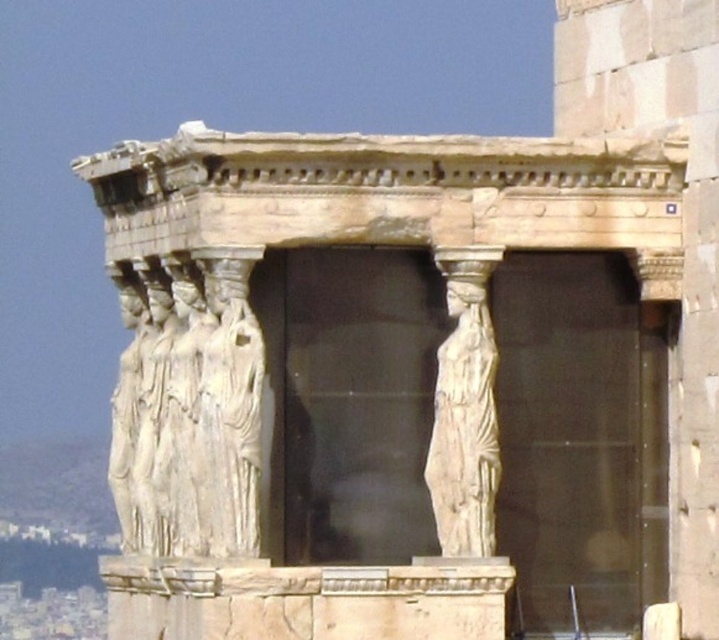
Does white marble statues at center have a lesser height compared to white marble statue at center?

No, white marble statues at center is not shorter than white marble statue at center.

Which is more to the right, white marble statues at center or white marble statue at center?

white marble statue at center

Is point (147, 486) positioned after point (444, 541)?

Yes.

Where is `white marble statues at center`? The height and width of the screenshot is (640, 719). white marble statues at center is located at coordinates (188, 412).